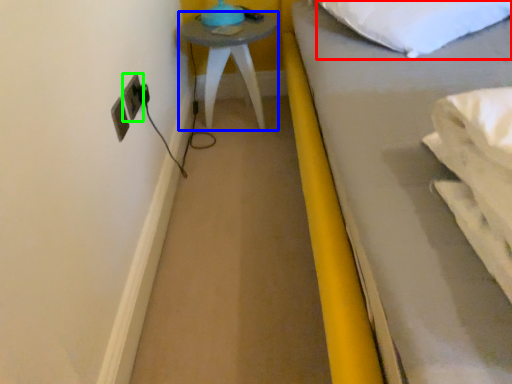
Question: Which is nearer to the pillow (highlighted by a red box)? furniture (highlighted by a blue box) or electric outlet (highlighted by a green box).

Choices:
 (A) furniture
 (B) electric outlet

Answer: (A)